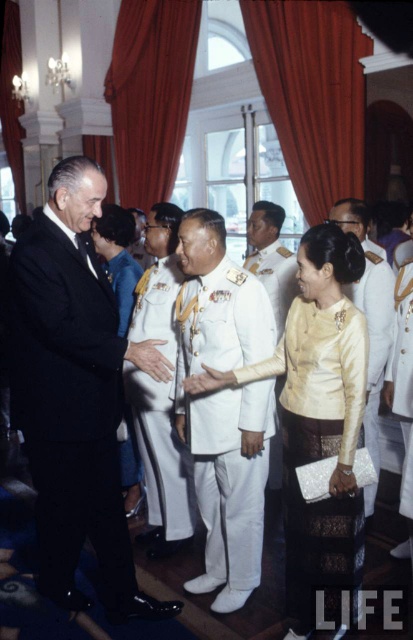
Question: Is blue fabric dress at center bigger than white glossy uniform at center?

Choices:
 (A) yes
 (B) no

Answer: (B)

Question: Which object is positioned farthest from the silk cream blouse at center?

Choices:
 (A) white uniform at center
 (B) silk white robe at center

Answer: (B)

Question: Which point appears farthest from the camera in this image?

Choices:
 (A) (387, 371)
 (B) (139, 332)
 (C) (381, 260)
 (D) (111, 282)

Answer: (D)

Question: Estimate the real-world distances between objects in this image. Which object is closer to the blue fabric dress at center?

Choices:
 (A) silk cream blouse at center
 (B) black suit at left
 (C) silk white robe at center
 (D) white satin uniform at center

Answer: (D)

Question: Is black suit at left above blue fabric dress at center?

Choices:
 (A) yes
 (B) no

Answer: (B)

Question: Can you confirm if black suit at left is bigger than white glossy uniform at center?

Choices:
 (A) no
 (B) yes

Answer: (B)